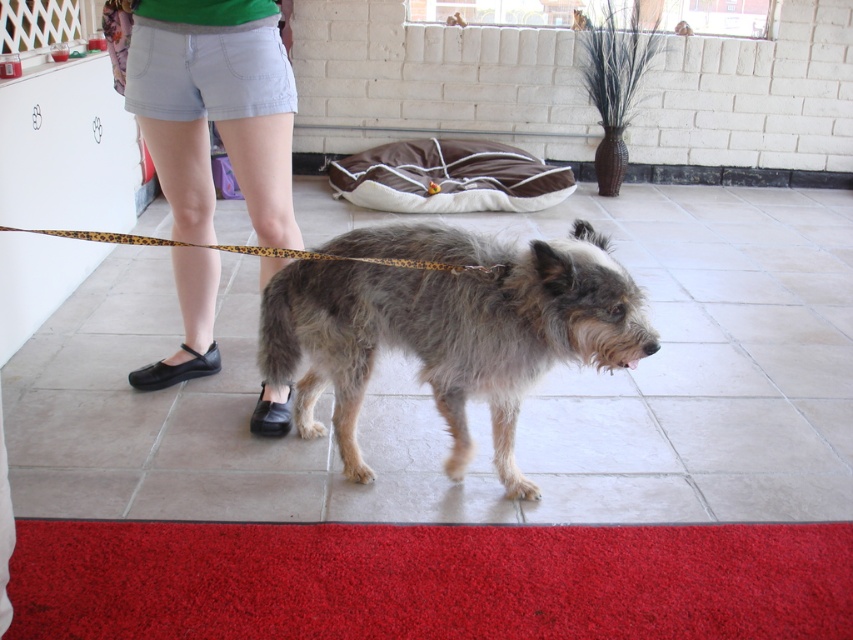
You are a photographer trying to capture the dog in the image. You notice the fuzzy fur dog at center and the light blue denim shorts at center. Which object is located to the right of the other?

The fuzzy fur dog at center is positioned on the right side of light blue denim shorts at center.

You are a photographer trying to capture the perfect shot of the light blue denim shorts at center and the leopard print leash at center. Based on their positions, which object is closer to the left side of the frame?

The light blue denim shorts at center are closer to the left side of the frame because they are positioned to the left of the leopard print leash at center.